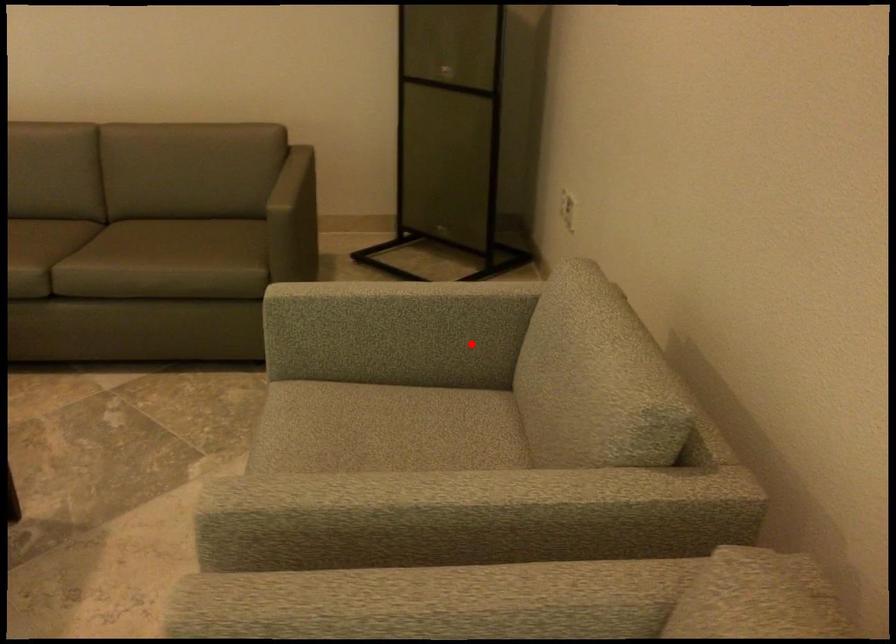
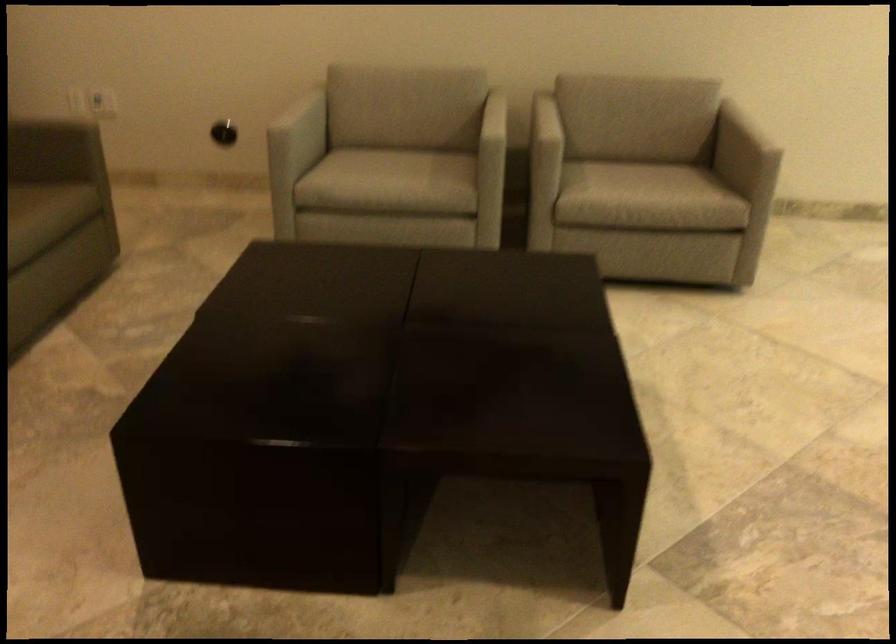
Question: I am providing you with two images of the same scene from different viewpoints. A red point is marked on the first image. At the location where the point appears in image 1, is it still visible in image 2?

Choices:
 (A) Yes
 (B) No

Answer: (A)